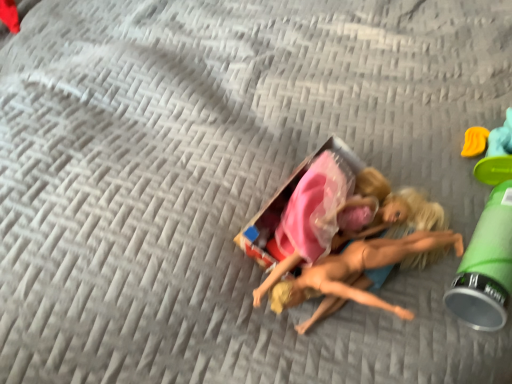
Question: Should I look upward or downward to see green plastic cup at lower right?

Choices:
 (A) down
 (B) up

Answer: (A)